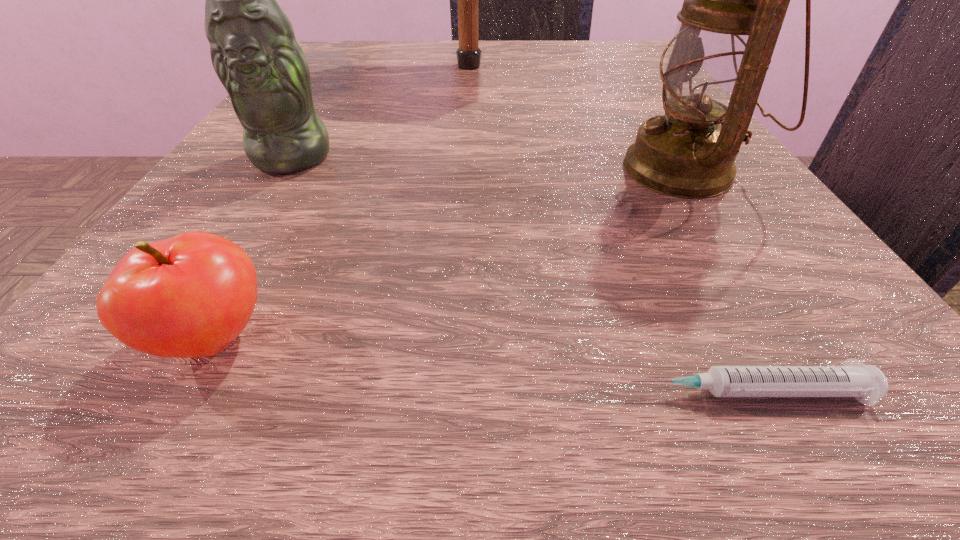
Locate an element on the screen. Image resolution: width=960 pixels, height=540 pixels. mallet is located at coordinates (468, 54).

Locate an element on the screen. Image resolution: width=960 pixels, height=540 pixels. the farthest object is located at coordinates (468, 54).

Locate an element on the screen. The height and width of the screenshot is (540, 960). oil lamp is located at coordinates (735, 0).

What are the coordinates of `beer bottle` in the screenshot? It's located at (254, 52).

Image resolution: width=960 pixels, height=540 pixels. I want to click on apple, so click(x=189, y=296).

Locate an element on the screen. This screenshot has width=960, height=540. the shortest object is located at coordinates (866, 383).

What are the coordinates of `vacant space situated 0.150m on the striking surface of the farthest object` in the screenshot? It's located at (612, 66).

I want to click on blank area located 0.180m on the front of the oil lamp, so click(802, 355).

Identify the location of vacant space situated 0.250m on the surface of the beer bottle. (177, 344).

This screenshot has width=960, height=540. Find the location of `vacant position located 0.080m on the back of the fourth tallest object`. vacant position located 0.080m on the back of the fourth tallest object is located at coordinates (270, 238).